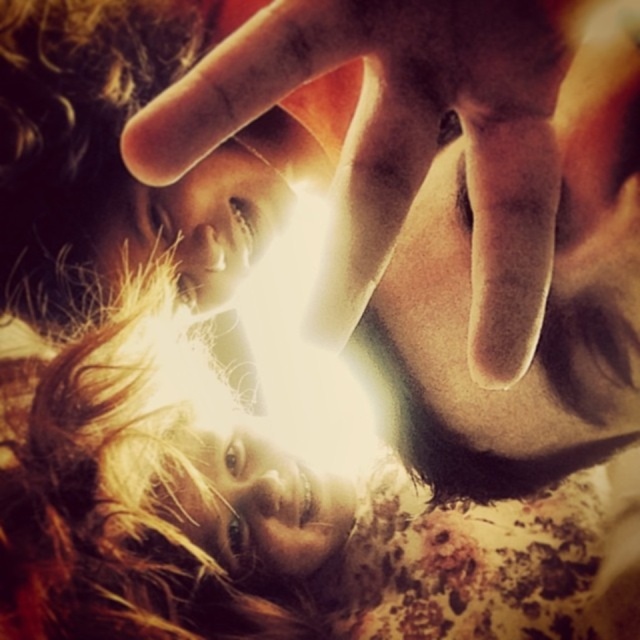
You are an artist trying to sketch this scene. You want to ensure the depth perception is accurate. Which object should you draw first in your sketch to maintain proper perspective, the blonde hair at center or the smooth skin hand at center?

The smooth skin hand at center should be drawn first because it is closer to the viewer than the blonde hair at center, so it should be placed in front to maintain proper perspective.

Based on the scene description, which object is positioned lower in the image between the blonde hair at center and the smooth skin hand at center?

The blonde hair at center is located below the smooth skin hand at center, so the blonde hair at center is positioned lower.